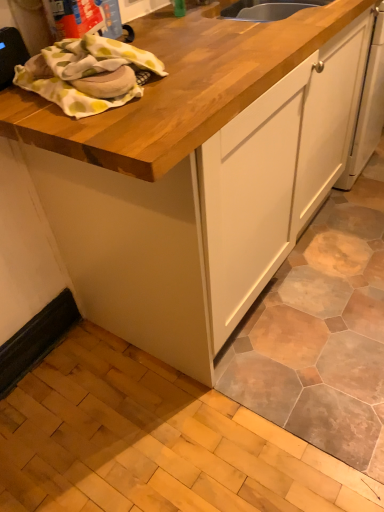
The width and height of the screenshot is (384, 512). I want to click on vacant area that is in front of yellow-green polka dot fabric at upper left, so [122, 120].